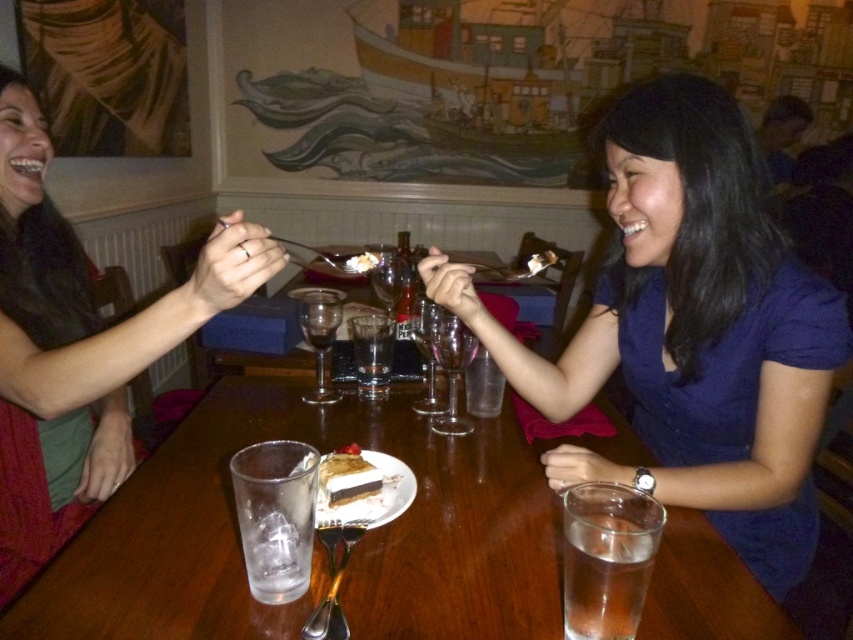
Question: Which object appears closest to the camera in this image?

Choices:
 (A) white creamy dessert at center
 (B) transparent glass at center

Answer: (A)

Question: Estimate the real-world distances between objects in this image. Which object is closer to the chocolate cake at center?

Choices:
 (A) blue smooth dress at center
 (B) white creamy dessert at center
 (C) clear glass at lower center
 (D) matte black shirt at left

Answer: (C)

Question: Which point is farther to the camera?

Choices:
 (A) (317, 346)
 (B) (512, 371)

Answer: (A)

Question: Can you confirm if clear glass at lower center is positioned to the right of transparent glass at center?

Choices:
 (A) no
 (B) yes

Answer: (B)

Question: Does matte black shirt at left appear on the right side of transparent glass at center?

Choices:
 (A) yes
 (B) no

Answer: (B)

Question: Where is blue smooth dress at center located in relation to matte black shirt at left in the image?

Choices:
 (A) above
 (B) below

Answer: (B)